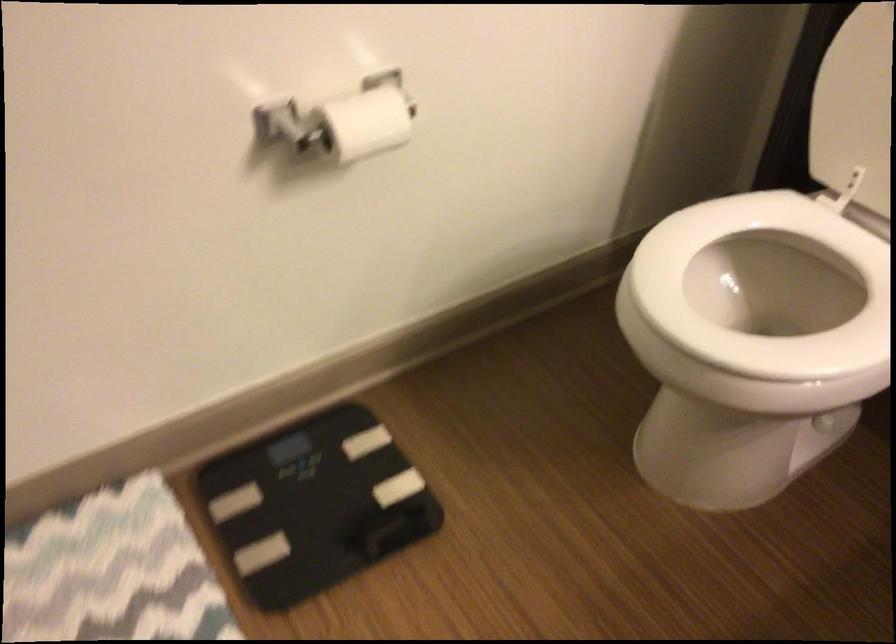
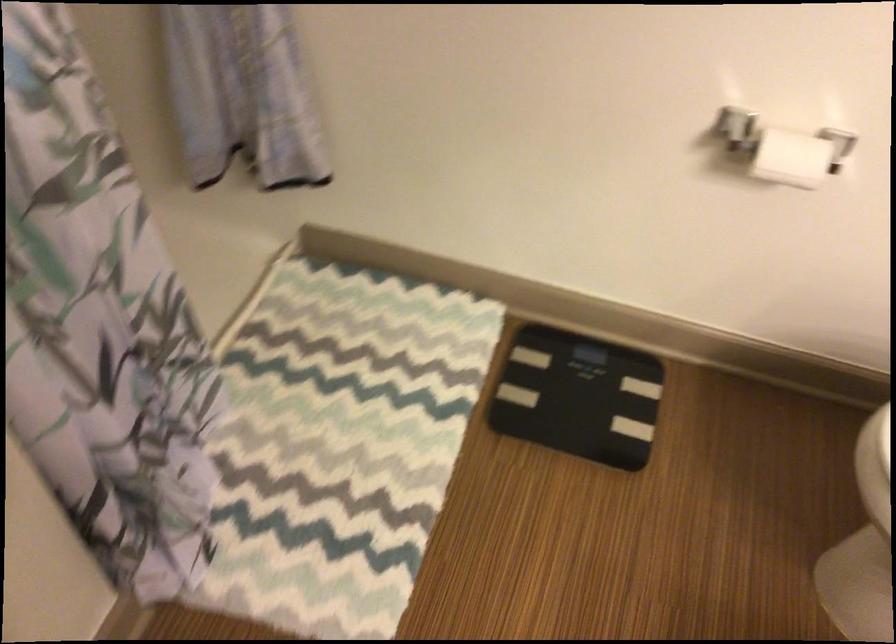
In the second image, find the point that corresponds to point (357, 126) in the first image.

(798, 156)